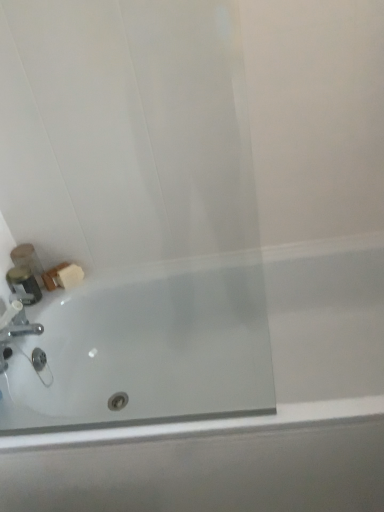
Question: From a real-world perspective, is white glossy bathtub at lower left physically below matte plastic soap at lower left, the 2th toiletry from the front?

Choices:
 (A) no
 (B) yes

Answer: (B)

Question: Can you confirm if white glossy bathtub at lower left is shorter than matte plastic soap at lower left, the 1th toiletry in the back-to-front sequence?

Choices:
 (A) yes
 (B) no

Answer: (B)

Question: Does white glossy bathtub at lower left appear on the right side of matte plastic soap at lower left, the 1th toiletry in the back-to-front sequence?

Choices:
 (A) yes
 (B) no

Answer: (A)

Question: Can you confirm if white glossy bathtub at lower left is wider than matte plastic soap at lower left, the 2th toiletry from the front?

Choices:
 (A) yes
 (B) no

Answer: (A)

Question: Does white glossy bathtub at lower left have a larger size compared to matte plastic soap at lower left, the 1th toiletry in the back-to-front sequence?

Choices:
 (A) yes
 (B) no

Answer: (A)

Question: Based on their positions, is matte plastic soap at lower left, the 2th toiletry from the front, located to the left or right of white glossy bathtub at lower left?

Choices:
 (A) right
 (B) left

Answer: (B)

Question: Is matte plastic soap at lower left, the 1th toiletry in the back-to-front sequence, inside or outside of white glossy bathtub at lower left?

Choices:
 (A) inside
 (B) outside

Answer: (B)

Question: From their relative heights in the image, would you say matte plastic soap at lower left, the 1th toiletry in the back-to-front sequence, is taller or shorter than white glossy bathtub at lower left?

Choices:
 (A) tall
 (B) short

Answer: (B)

Question: From a real-world perspective, is matte plastic soap at lower left, the 1th toiletry in the back-to-front sequence, above or below white glossy bathtub at lower left?

Choices:
 (A) below
 (B) above

Answer: (B)

Question: In terms of size, does white glossy bathtub at lower left appear bigger or smaller than metallic silver container at left, the 1th toiletry when ordered from front to back?

Choices:
 (A) big
 (B) small

Answer: (A)

Question: From their relative heights in the image, would you say white glossy bathtub at lower left is taller or shorter than metallic silver container at left, the second toiletry positioned from the back?

Choices:
 (A) tall
 (B) short

Answer: (A)

Question: Choose the correct answer: Is white glossy bathtub at lower left inside metallic silver container at left, the second toiletry positioned from the back, or outside it?

Choices:
 (A) outside
 (B) inside

Answer: (A)

Question: From a real-world perspective, is white glossy bathtub at lower left above or below metallic silver container at left, the second toiletry positioned from the back?

Choices:
 (A) below
 (B) above

Answer: (A)

Question: From a real-world perspective, is metallic silver container at left, the second toiletry positioned from the back, above or below silver metallic faucet at lower left?

Choices:
 (A) above
 (B) below

Answer: (B)

Question: From the image's perspective, is metallic silver container at left, the 1th toiletry when ordered from front to back, above or below silver metallic faucet at lower left?

Choices:
 (A) below
 (B) above

Answer: (B)